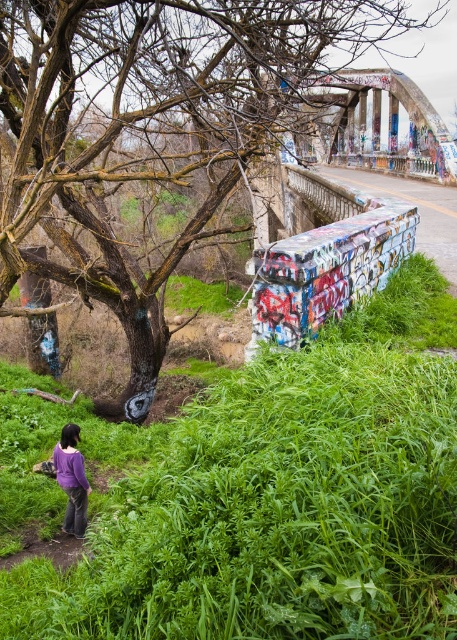
You are standing at the point labeled point (121, 97) and want to walk to the point labeled point (67, 516). Given that both points are on the same dirt path, which direction should you face to move towards your destination?

You should face towards the right because point (67, 516) is located to the right of point (121, 97).

You are standing at the edge of the dirt path and want to take a photo of the green leafy grass at lower center and the brown bark tree at upper left. Which object should you focus on first if you want both to be in sharp focus?

Since the green leafy grass at lower center is below the brown bark tree at upper left, you should focus on the brown bark tree at upper left first to ensure both are in focus as it is farther away.